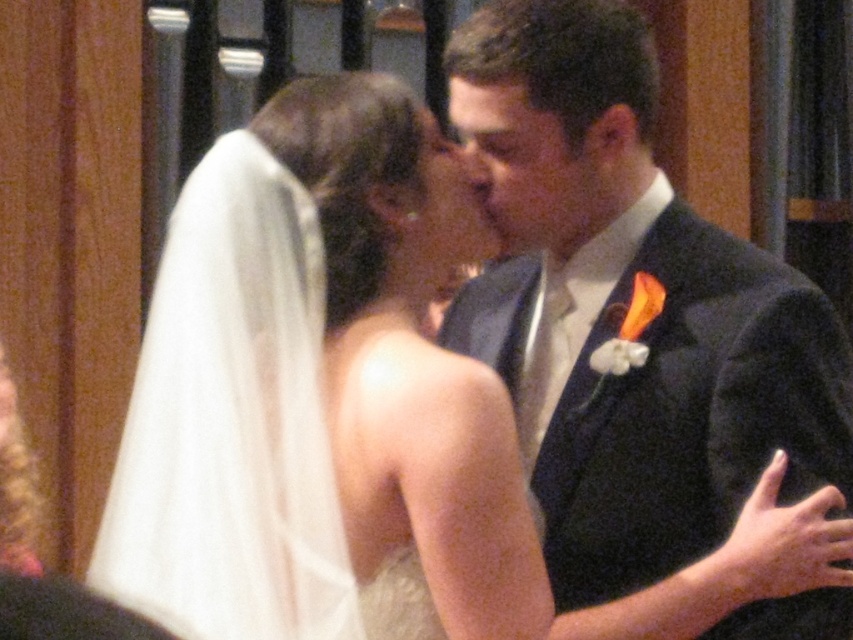
Question: Among these points, which one is farthest from the camera?

Choices:
 (A) (839, 429)
 (B) (462, 77)

Answer: (B)

Question: Does matte black suit at center have a larger size compared to matte black forehead at center?

Choices:
 (A) yes
 (B) no

Answer: (A)

Question: Does matte black suit at center appear on the right side of matte black forehead at center?

Choices:
 (A) no
 (B) yes

Answer: (B)

Question: Is matte black suit at center smaller than matte black forehead at center?

Choices:
 (A) yes
 (B) no

Answer: (B)